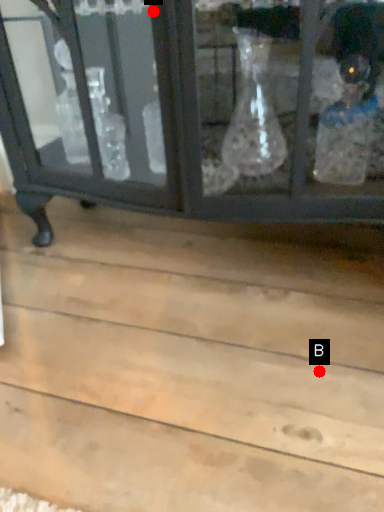
Question: Two points are circled on the image, labeled by A and B beside each circle. Among these points, which one is nearest to the camera?

Choices:
 (A) A is closer
 (B) B is closer

Answer: (A)